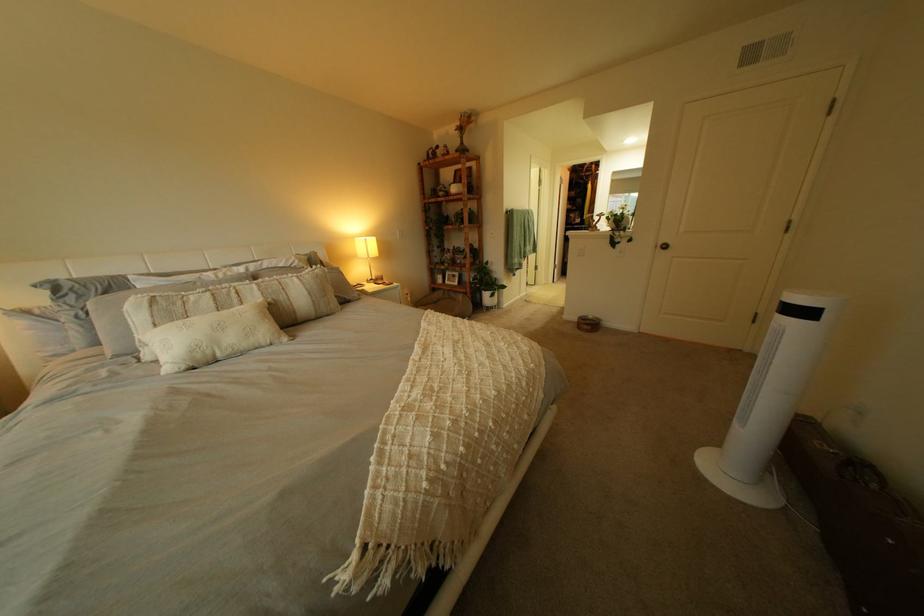
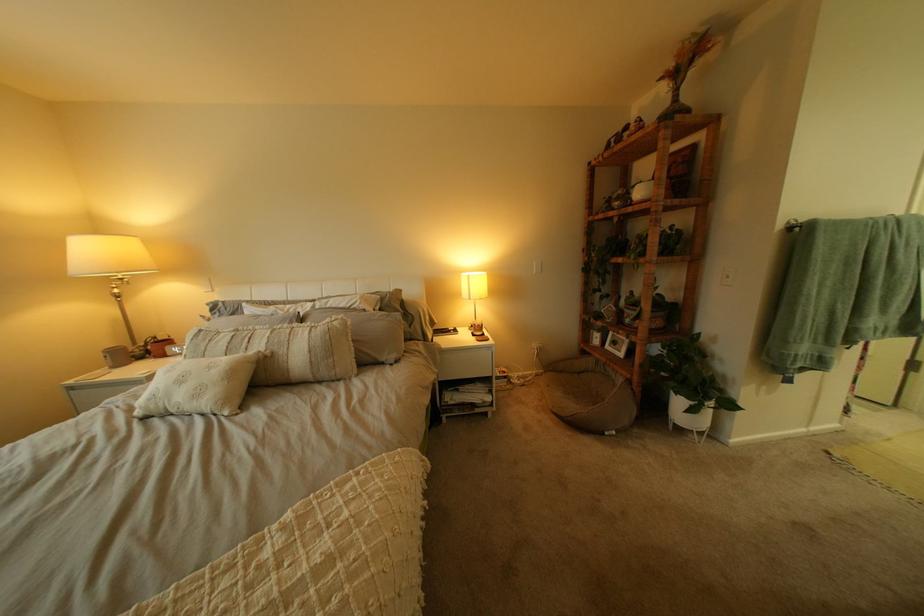
Where in the second image is the point corresponding to the point at 381,240 from the first image?

(483, 277)